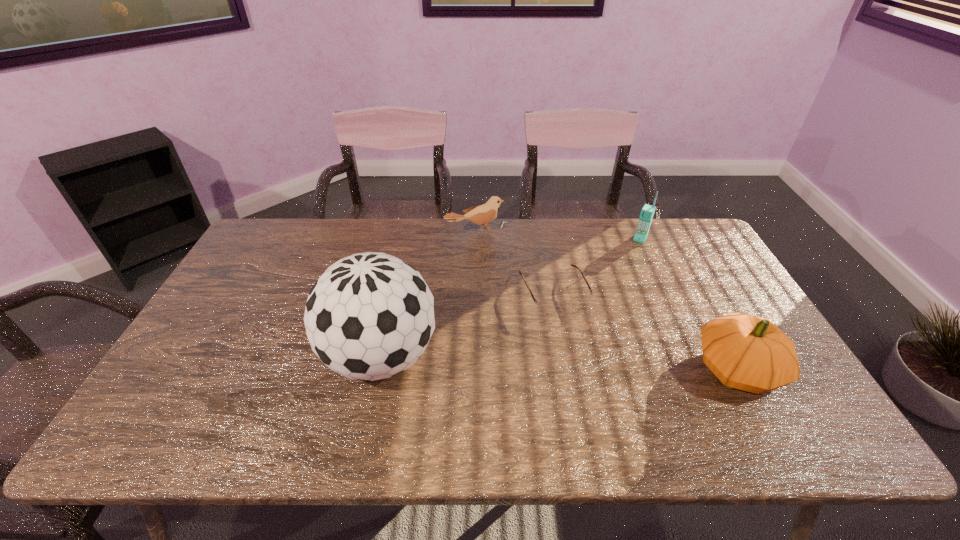
Find the location of a particular element. vacant space on the desktop that is between the tallest object and the gourd and is positioned on the keypad of the cellular telephone is located at coordinates (569, 363).

Image resolution: width=960 pixels, height=540 pixels. What are the coordinates of `free space on the desktop that is between the tallest object and the gourd and is positioned at the beak of the second shortest object` in the screenshot? It's located at 578,363.

Locate an element on the screen. The width and height of the screenshot is (960, 540). free space on the desktop that is between the soccer ball and the gourd and is positioned on the front-facing side of the shortest object is located at coordinates (589, 364).